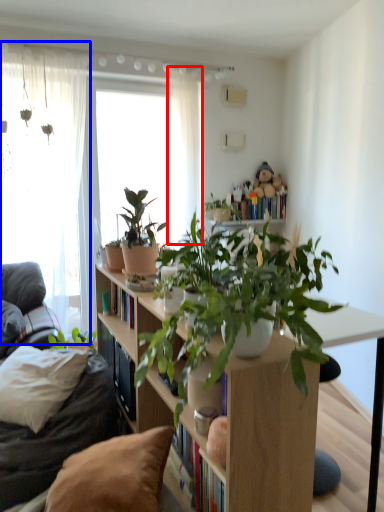
Question: Which object appears farthest to the camera in this image, curtain (highlighted by a red box) or window (highlighted by a blue box)?

Choices:
 (A) curtain
 (B) window

Answer: (A)